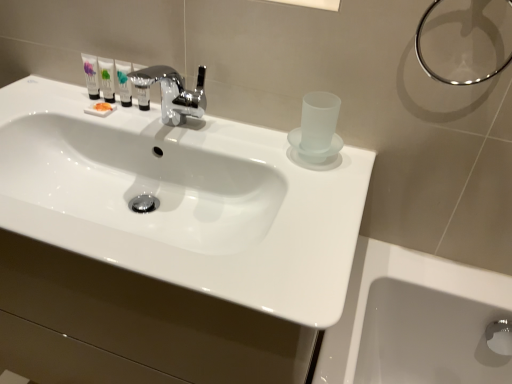
Locate an element on the screen. This screenshot has height=384, width=512. free space on the front side of satin silver bottle at center, which ranks as the 4th mouthwash in left-to-right order is located at coordinates (137, 130).